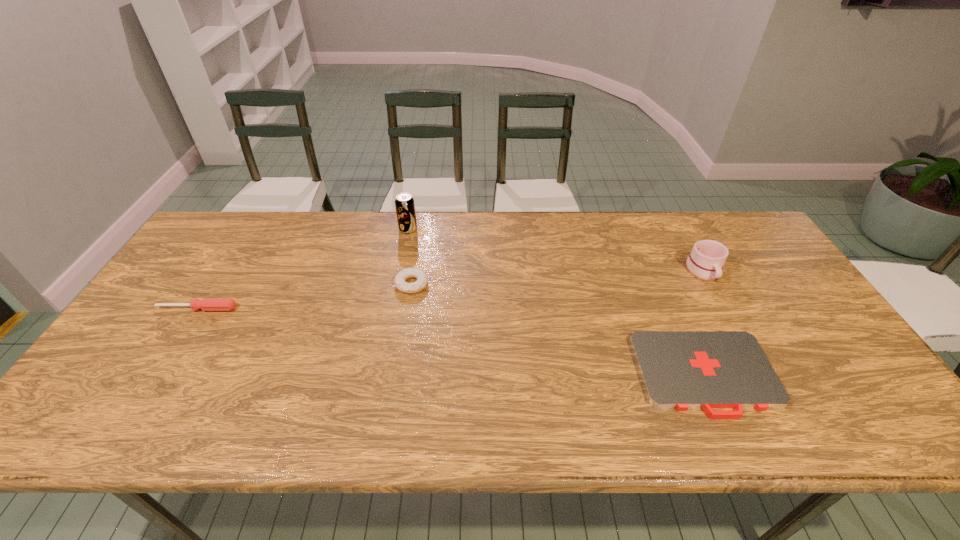
The width and height of the screenshot is (960, 540). Find the location of `empty location between the second tallest object and the doughnut`. empty location between the second tallest object and the doughnut is located at coordinates (558, 278).

At what (x,y) coordinates should I click in order to perform the action: click on free point between the first-aid kit and the doughnut. Please return your answer as a coordinate pair (x, y). Looking at the image, I should click on (559, 329).

The height and width of the screenshot is (540, 960). I want to click on object that is the closest to the first-aid kit, so click(x=705, y=262).

The image size is (960, 540). I want to click on object that is the second closest to the doughnut, so (x=206, y=304).

I want to click on free point that satisfies the following two spatial constraints: 1. on the back side of the leftmost object; 2. on the right side of the tallest object, so click(248, 229).